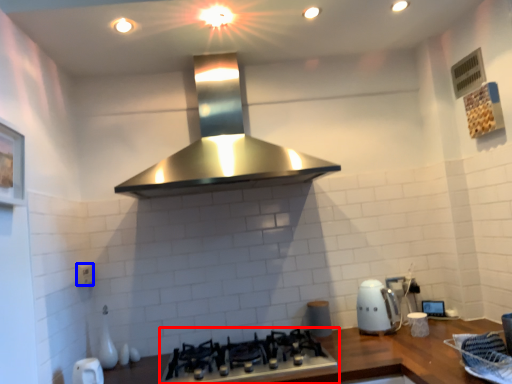
Question: Which object appears farthest to the camera in this image, gas stove (highlighted by a red box) or electric outlet (highlighted by a blue box)?

Choices:
 (A) gas stove
 (B) electric outlet

Answer: (B)